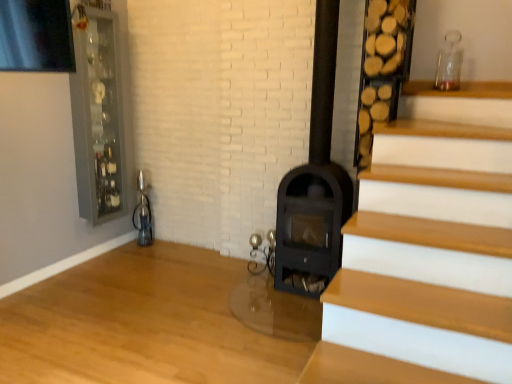
Question: Is the depth of black matte fireplace at center less than that of clear glass cabinet at upper left?

Choices:
 (A) no
 (B) yes

Answer: (B)

Question: Is black matte fireplace at center oriented towards clear glass cabinet at upper left?

Choices:
 (A) yes
 (B) no

Answer: (B)

Question: From a real-world perspective, does black matte fireplace at center stand above clear glass cabinet at upper left?

Choices:
 (A) no
 (B) yes

Answer: (A)

Question: Is black matte fireplace at center positioned beyond the bounds of clear glass cabinet at upper left?

Choices:
 (A) yes
 (B) no

Answer: (A)

Question: From a real-world perspective, is black matte fireplace at center physically below clear glass cabinet at upper left?

Choices:
 (A) yes
 (B) no

Answer: (A)

Question: Can you confirm if black matte fireplace at center is taller than clear glass cabinet at upper left?

Choices:
 (A) no
 (B) yes

Answer: (B)

Question: Is clear glass cabinet at upper left not near black matte fireplace at center?

Choices:
 (A) yes
 (B) no

Answer: (A)

Question: Is clear glass cabinet at upper left oriented away from black matte fireplace at center?

Choices:
 (A) yes
 (B) no

Answer: (B)

Question: Can you confirm if clear glass cabinet at upper left is shorter than black matte fireplace at center?

Choices:
 (A) yes
 (B) no

Answer: (A)

Question: Would you say clear glass cabinet at upper left contains black matte fireplace at center?

Choices:
 (A) no
 (B) yes

Answer: (A)

Question: From a real-world perspective, is clear glass cabinet at upper left located higher than black matte fireplace at center?

Choices:
 (A) no
 (B) yes

Answer: (B)

Question: Can you confirm if clear glass cabinet at upper left is smaller than black matte fireplace at center?

Choices:
 (A) no
 (B) yes

Answer: (B)

Question: Visually, is clear glass cabinet at upper left positioned to the left or to the right of black matte fireplace at center?

Choices:
 (A) left
 (B) right

Answer: (A)